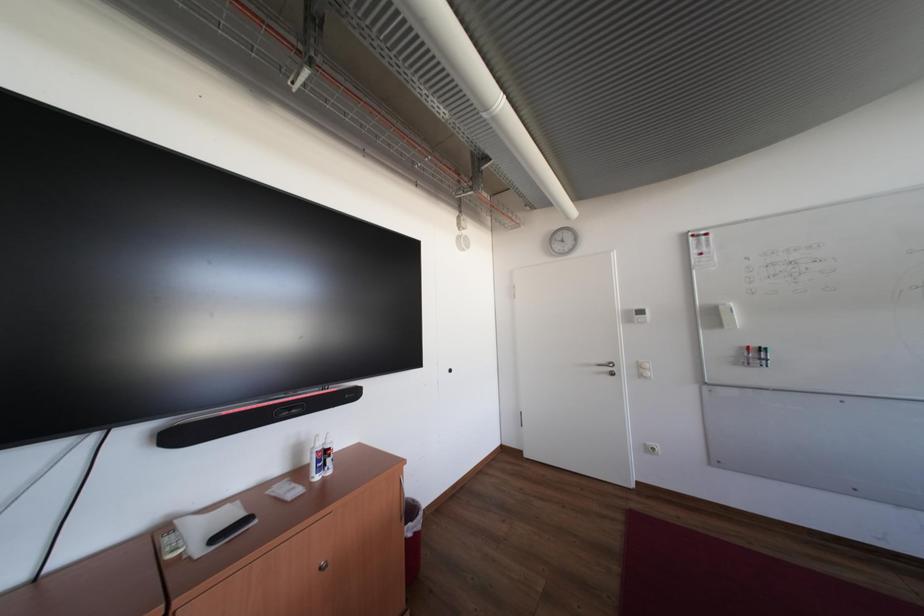
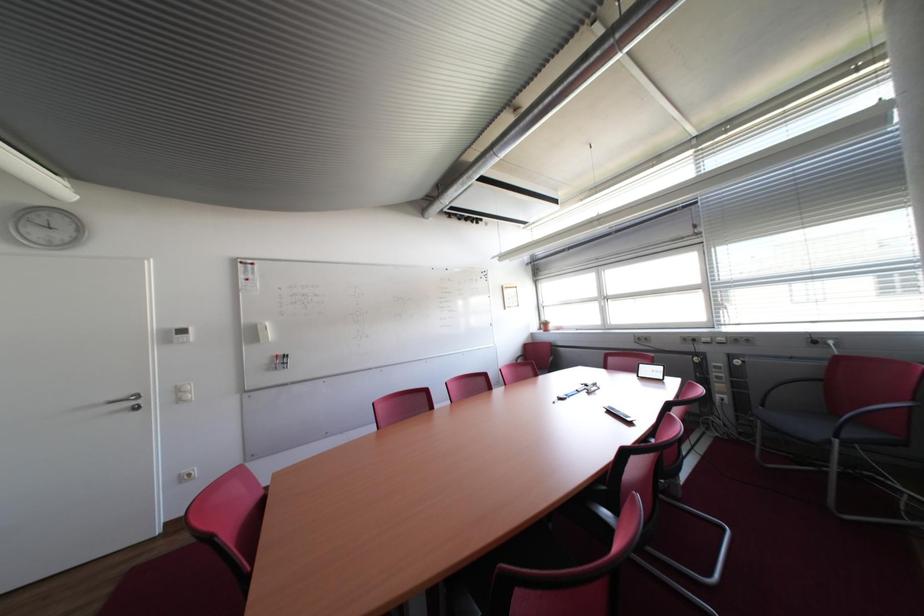
Question: The first image is from the beginning of the video and the second image is from the end. How did the camera likely rotate when shooting the video?

Choices:
 (A) Left
 (B) Right
 (C) Up
 (D) Down

Answer: (B)